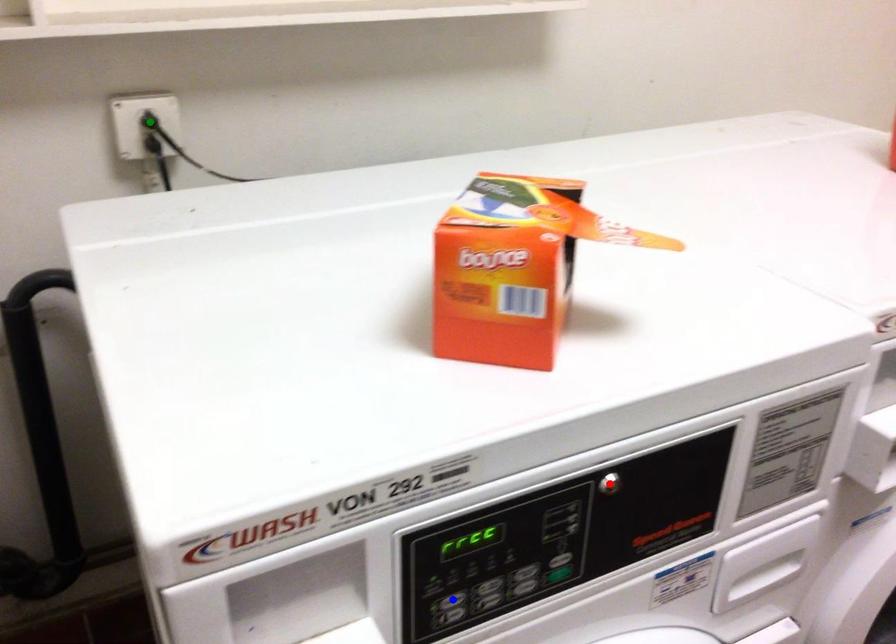
In the scene shown: Order these from nearest to farthest:
1. blue point
2. red point
3. green point

1. green point
2. red point
3. blue point